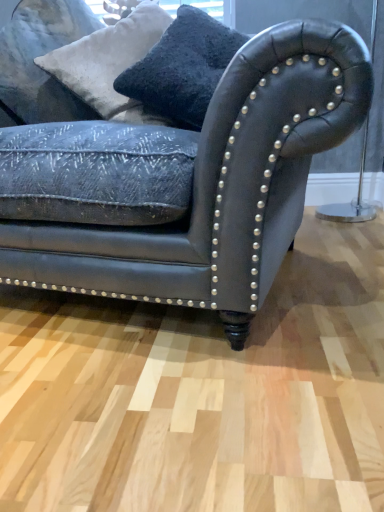
Question: Is point (112, 106) closer or farther from the camera than point (205, 83)?

Choices:
 (A) closer
 (B) farther

Answer: (B)

Question: Considering the positions of white textured pillow at upper left, the 2th pillow in the right-to-left sequence, and velvety black pillow at upper center, the 2th pillow when ordered from left to right, in the image, is white textured pillow at upper left, the 2th pillow in the right-to-left sequence, bigger or smaller than velvety black pillow at upper center, the 2th pillow when ordered from left to right,?

Choices:
 (A) big
 (B) small

Answer: (A)

Question: Estimate the real-world distances between objects in this image. Which object is closer to the velvety black pillow at upper center, the 2th pillow when ordered from left to right?

Choices:
 (A) white textured pillow at upper left, the 2th pillow in the right-to-left sequence
 (B) leather couch at center

Answer: (A)

Question: Estimate the real-world distances between objects in this image. Which object is closer to the leather couch at center?

Choices:
 (A) velvety black pillow at upper center, the 2th pillow when ordered from left to right
 (B) white textured pillow at upper left, the first pillow viewed from the left

Answer: (A)